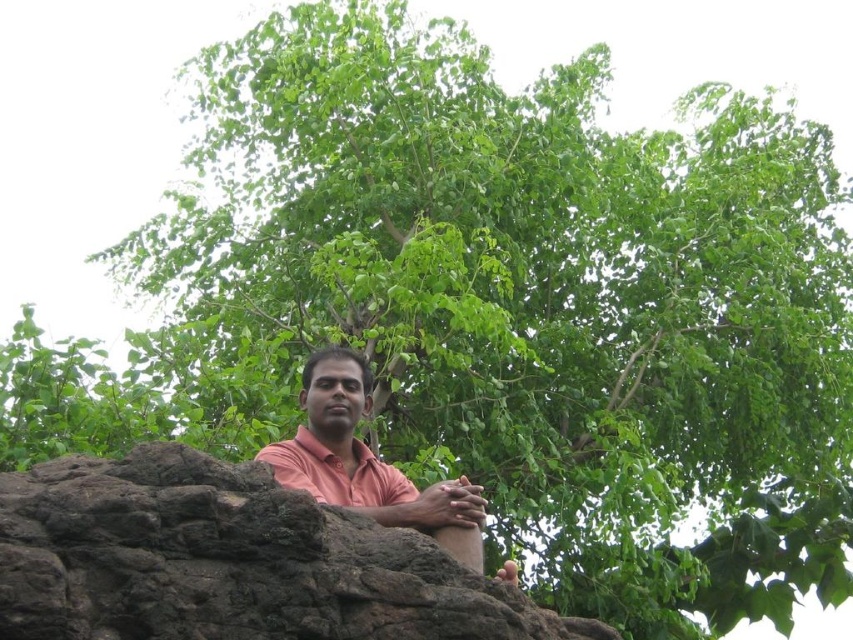
You are a hiker who wants to place a small backpack on the ground near the man. The coordinates of the man are at point (229, 561). Is there a brown rough rock at center where you can place your backpack?

Yes, at point (229, 561) lies brown rough rock at center, so you can place your backpack there.